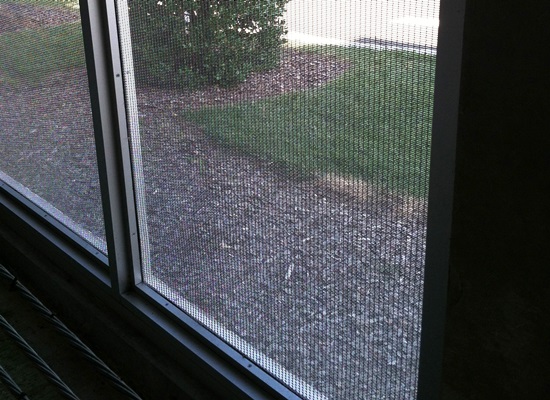
This screenshot has width=550, height=400. Identify the location of 4 window frame bars. (92, 265), (117, 260), (157, 317), (438, 246).